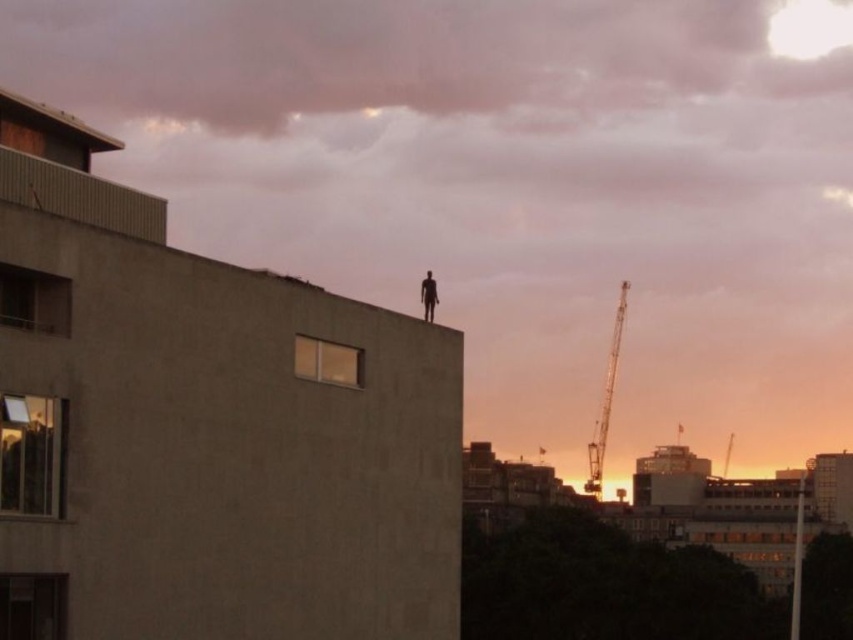
Who is positioned more to the left, pink fluffy cloud at upper center or silhouette figure at center?

Positioned to the left is pink fluffy cloud at upper center.

Which is above, pink fluffy cloud at upper center or silhouette figure at center?

pink fluffy cloud at upper center is above.

Is point (96, 100) closer to camera compared to point (434, 296)?

No, it is not.

Find the location of a particular element. The image size is (853, 640). pink fluffy cloud at upper center is located at coordinates (393, 58).

Does metallic gray crane at right come in front of silhouette figure at center?

No.

Is point (593, 474) farther from camera compared to point (430, 317)?

Yes.

Does point (593, 472) come in front of point (426, 272)?

No, it is not.

Find the location of a particular element. metallic gray crane at right is located at coordinates (605, 401).

Which of these two, pink fluffy cloud at upper center or metallic gray crane at right, stands shorter?

pink fluffy cloud at upper center

Does pink fluffy cloud at upper center have a smaller size compared to metallic gray crane at right?

Incorrect, pink fluffy cloud at upper center is not smaller in size than metallic gray crane at right.

Who is more distant from viewer, (485, 12) or (596, 444)?

The point (485, 12) is behind.

Locate an element on the screen. This screenshot has width=853, height=640. pink fluffy cloud at upper center is located at coordinates (393, 58).